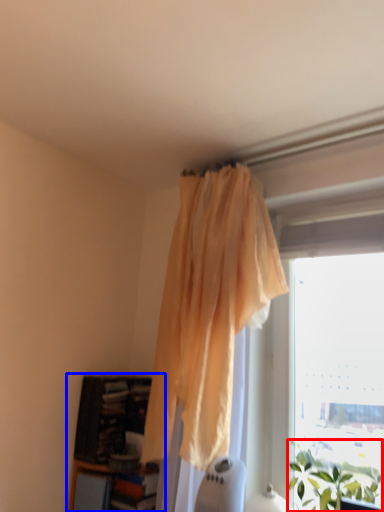
Question: Which point is closer to the camera, plant (highlighted by a red box) or bookcase (highlighted by a blue box)?

Choices:
 (A) plant
 (B) bookcase

Answer: (A)